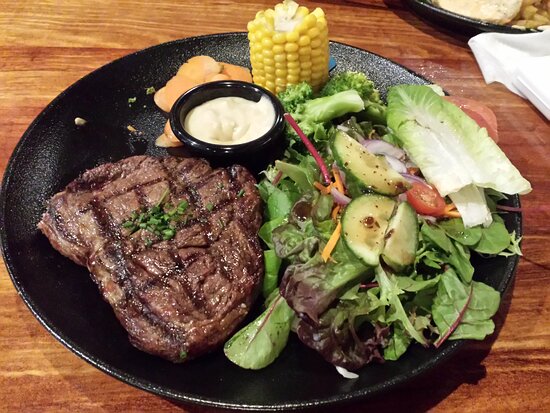
At what (x,y) coordinates should I click in order to perform the action: click on cloth napkins. Please return your answer as a coordinate pair (x, y). The height and width of the screenshot is (413, 550). Looking at the image, I should click on (530, 71).